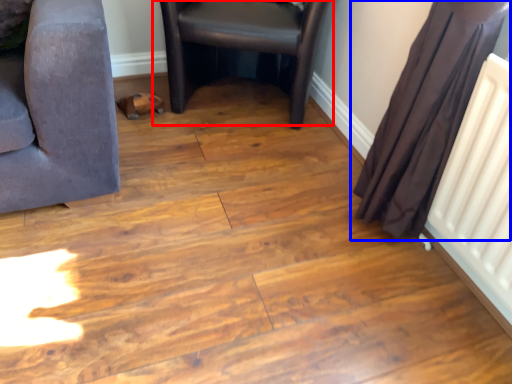
Question: Which of the following is the closest to the observer, chair (highlighted by a red box) or curtain (highlighted by a blue box)?

Choices:
 (A) chair
 (B) curtain

Answer: (B)